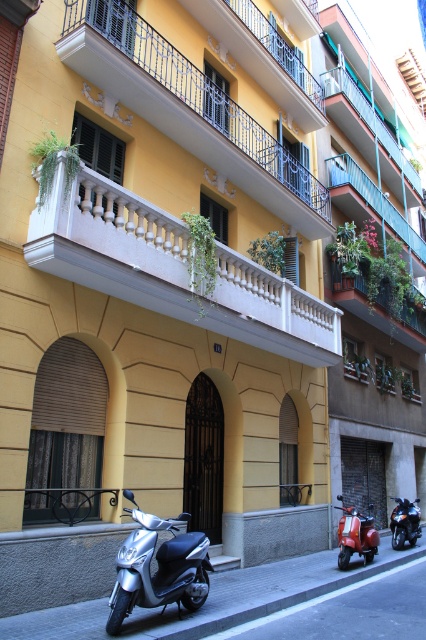
You are a delivery person trying to park your silver metallic scooter at lower left near the entrance. However, there is a metallic blue balcony at upper right above the entrance. Is the scooter parked to the left or right of the balcony?

The silver metallic scooter at lower left is positioned on the left side of the metallic blue balcony at upper right, so the scooter is parked to the left of the balcony.

You are a delivery person trying to park your silver metallic scooter at lower left near the white stone balcony at upper center. Considering the height difference between them, will the scooter be visible from the balcony?

The white stone balcony at upper center has a lesser height compared to the silver metallic scooter at lower left. Since the balcony is lower, the scooter at lower left would be positioned below it, making it potentially visible from the balcony depending on the angle and obstruction.